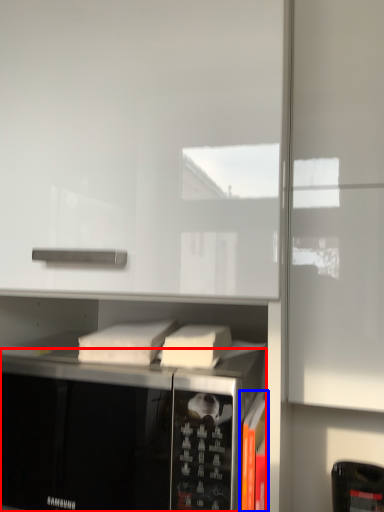
Question: Among these objects, which one is nearest to the camera, microwave oven (highlighted by a red box) or book (highlighted by a blue box)?

Choices:
 (A) microwave oven
 (B) book

Answer: (A)